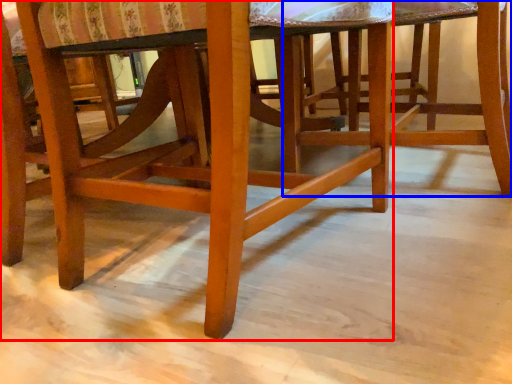
Question: Which of the following is the farthest to the observer, chair (highlighted by a red box) or stool (highlighted by a blue box)?

Choices:
 (A) chair
 (B) stool

Answer: (B)